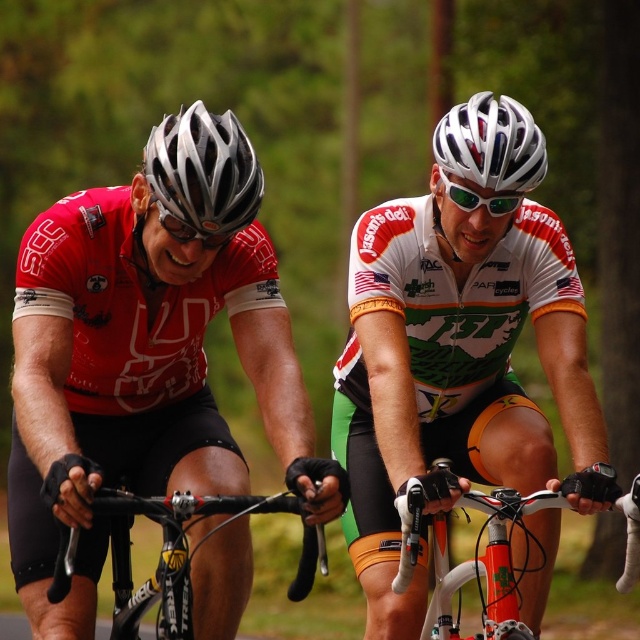
You are a photographer trying to capture a clear shot of the matte black helmet at center and the white glossy bicycle handlebars at center. Which object should you focus on first if you want to ensure both are in focus without adjusting your camera settings?

The matte black helmet at center is taller than the white glossy bicycle handlebars at center, so you should focus on the taller matte black helmet at center first to ensure both are in focus.

In the scene shown: You are a photographer positioned behind the cyclists and want to capture a clear shot of both the white glossy bicycle handlebars at center and the black matte bicycle handlebars at center. Based on their positions, which handlebars are closer to the camera?

Result: The white glossy bicycle handlebars at center are closer to the camera because they are positioned below the black matte bicycle handlebars at center, indicating they are in front in the visual plane.

You are a photographer trying to capture a photo of both cyclists. The white glossy bicycle handlebars at center and the black matte bicycle handlebars at center are in your viewfinder. Which handlebars should you focus on to ensure the cyclist on the right is in the frame?

The white glossy bicycle handlebars at center are to the right of the black matte bicycle handlebars at center. Since the cyclist on the right is associated with the white handlebars, focusing on them ensures the cyclist on the right is in the frame.